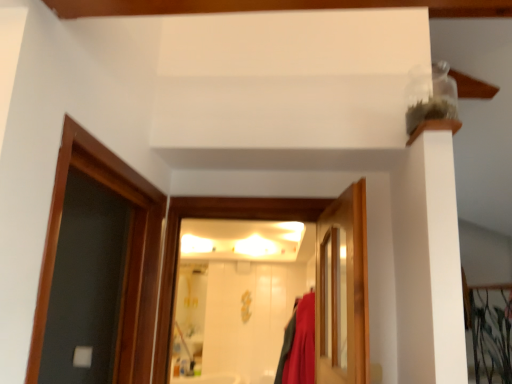
Question: Is wooden door at center, positioned as the second door in left-to-right order, in front of or behind white glossy door at center, positioned as the 2th door in right-to-left order, in the image?

Choices:
 (A) behind
 (B) front

Answer: (B)

Question: Which is correct: wooden door at center, positioned as the second door in left-to-right order, is inside white glossy door at center, positioned as the 2th door in right-to-left order, or outside of it?

Choices:
 (A) inside
 (B) outside

Answer: (B)

Question: Is wooden door at center, which appears as the first door when viewed from the right, taller or shorter than white glossy door at center, which ranks as the 1th door in left-to-right order?

Choices:
 (A) short
 (B) tall

Answer: (A)

Question: In the image, is white glossy door at center, positioned as the 2th door in right-to-left order, on the left side or the right side of wooden door at center, positioned as the second door in left-to-right order?

Choices:
 (A) right
 (B) left

Answer: (B)

Question: Looking at their shapes, would you say white glossy door at center, positioned as the 2th door in right-to-left order, is wider or thinner than wooden door at center, which appears as the first door when viewed from the right?

Choices:
 (A) wide
 (B) thin

Answer: (A)

Question: Considering the positions of white glossy door at center, which ranks as the 1th door in left-to-right order, and wooden door at center, which appears as the first door when viewed from the right, in the image, is white glossy door at center, which ranks as the 1th door in left-to-right order, bigger or smaller than wooden door at center, which appears as the first door when viewed from the right,?

Choices:
 (A) small
 (B) big

Answer: (B)

Question: Relative to wooden door at center, positioned as the second door in left-to-right order, is white glossy door at center, which ranks as the 1th door in left-to-right order, in front or behind?

Choices:
 (A) front
 (B) behind

Answer: (B)